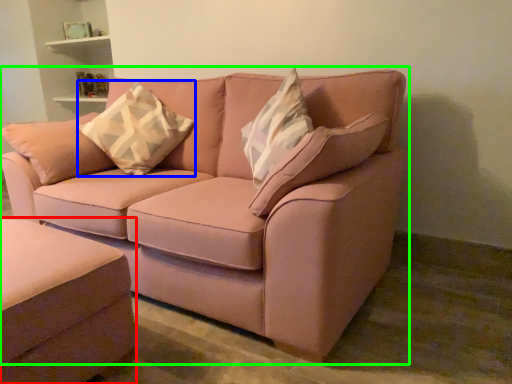
Question: Which object is the farthest from studio couch (highlighted by a red box)? Choose among these: throw pillow (highlighted by a blue box) or studio couch (highlighted by a green box).

Choices:
 (A) throw pillow
 (B) studio couch

Answer: (A)